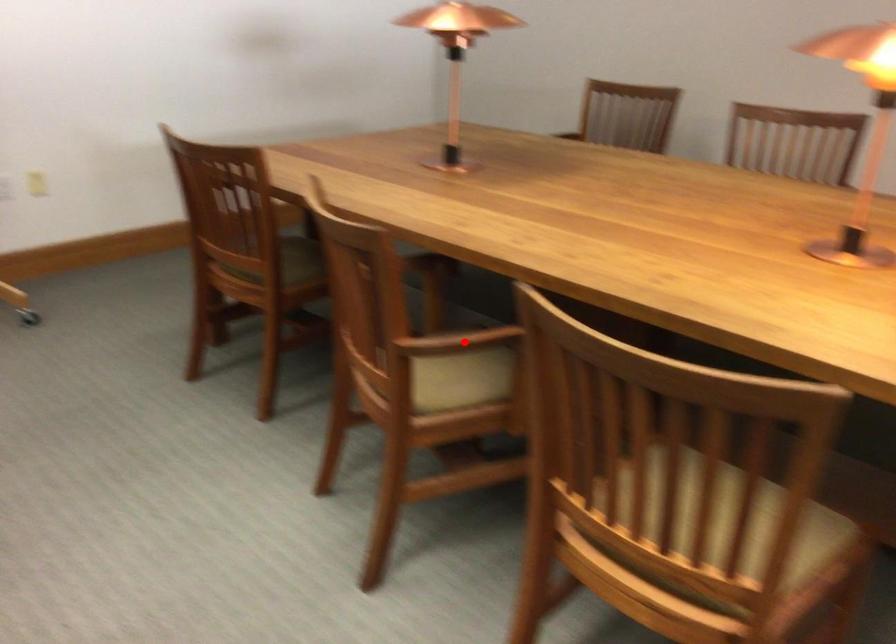
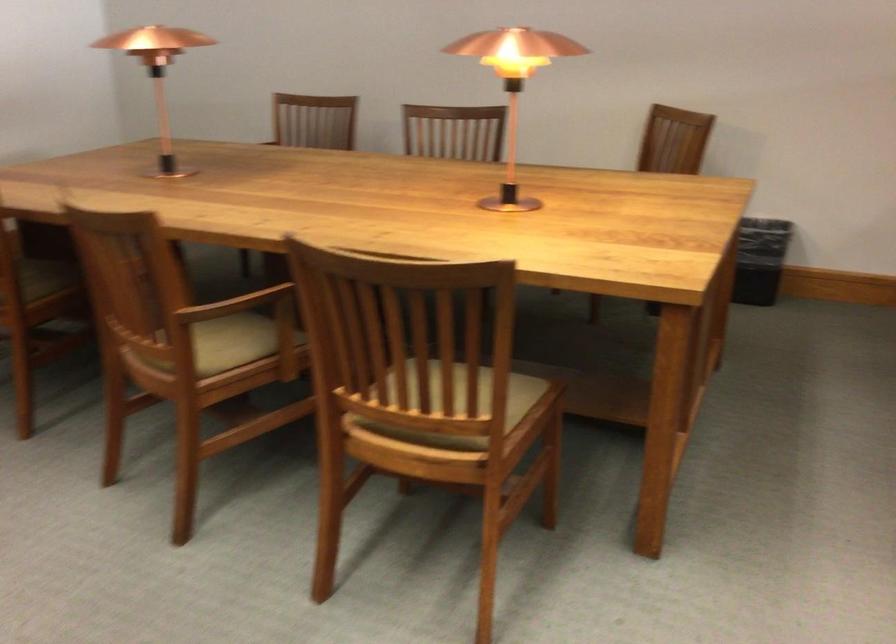
Question: I am providing you with two images of the same scene from different viewpoints. A red point is marked on the first image. Is the red point's position out of view in image 2?

Choices:
 (A) Yes
 (B) No

Answer: (B)